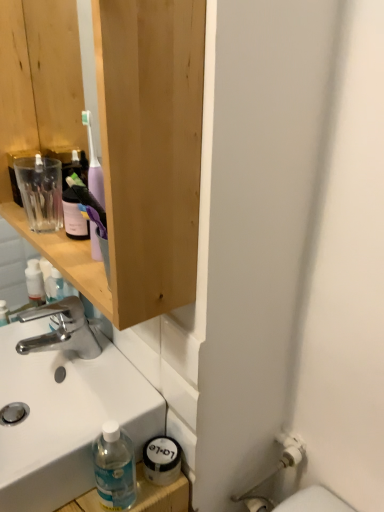
Question: Is white glossy sink at lower left bigger than wooden cabinet at upper left?

Choices:
 (A) yes
 (B) no

Answer: (B)

Question: Is white glossy sink at lower left closer to the viewer compared to wooden cabinet at upper left?

Choices:
 (A) yes
 (B) no

Answer: (B)

Question: Are white glossy sink at lower left and wooden cabinet at upper left far apart?

Choices:
 (A) no
 (B) yes

Answer: (A)

Question: Can you confirm if white glossy sink at lower left is smaller than wooden cabinet at upper left?

Choices:
 (A) no
 (B) yes

Answer: (B)

Question: Does white glossy sink at lower left have a lesser width compared to wooden cabinet at upper left?

Choices:
 (A) no
 (B) yes

Answer: (A)

Question: Is wooden cabinet at upper left inside white glossy sink at lower left?

Choices:
 (A) yes
 (B) no

Answer: (B)

Question: Is polished chrome faucet at center next to white glossy sink at lower left?

Choices:
 (A) yes
 (B) no

Answer: (B)

Question: Considering the relative sizes of polished chrome faucet at center and white glossy sink at lower left in the image provided, is polished chrome faucet at center thinner than white glossy sink at lower left?

Choices:
 (A) no
 (B) yes

Answer: (B)

Question: Is there a large distance between polished chrome faucet at center and white glossy sink at lower left?

Choices:
 (A) yes
 (B) no

Answer: (B)

Question: Does polished chrome faucet at center have a smaller size compared to white glossy sink at lower left?

Choices:
 (A) no
 (B) yes

Answer: (B)

Question: Is polished chrome faucet at center not within white glossy sink at lower left?

Choices:
 (A) yes
 (B) no

Answer: (A)

Question: Is white glossy sink at lower left at the back of polished chrome faucet at center?

Choices:
 (A) yes
 (B) no

Answer: (B)

Question: From a real-world perspective, is white glossy sink at lower left positioned over polished chrome faucet at center based on gravity?

Choices:
 (A) yes
 (B) no

Answer: (B)